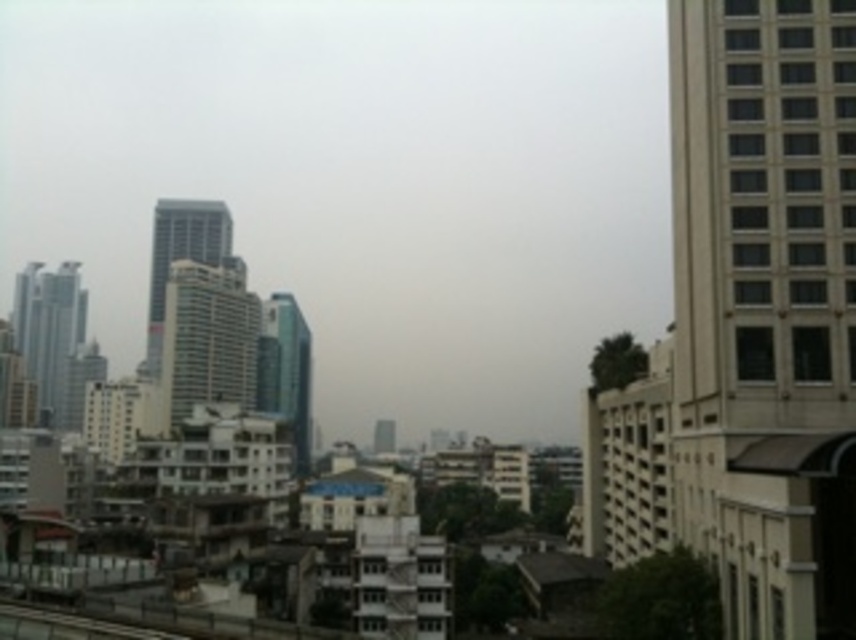
You are standing on a rooftop and looking at the urban landscape. There is a white glass building at center and a glassy steel skyscraper at left. Which one is higher in the view?

The white glass building at center is higher in the view because it is positioned above the glassy steel skyscraper at left.

You are standing on a rooftop and want to estimate how far the white glass building at center is from you. Based on the scene, can you determine the distance?

The white glass building at center is 881.21 feet away from the viewer.